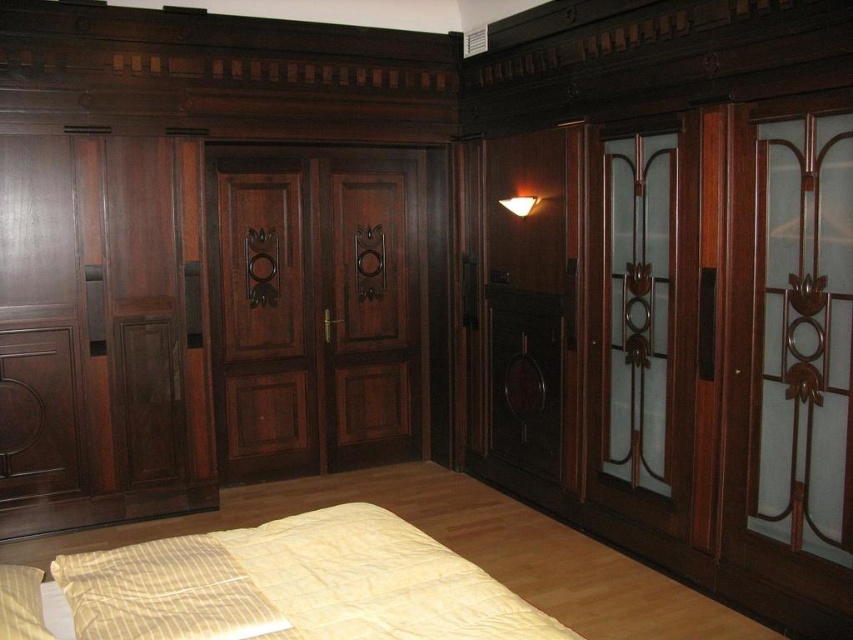
Is matte dark wood door at center to the left of matte white wall sconce at upper center from the viewer's perspective?

Correct, you'll find matte dark wood door at center to the left of matte white wall sconce at upper center.

Measure the distance between matte dark wood door at center and camera.

The distance of matte dark wood door at center from camera is 14.04 feet.

Describe the element at coordinates (314, 307) in the screenshot. I see `matte dark wood door at center` at that location.

Where is `matte dark wood door at center`? The height and width of the screenshot is (640, 853). matte dark wood door at center is located at coordinates (314, 307).

Locate an element on the screen. The image size is (853, 640). yellow striped fabric at lower center is located at coordinates (294, 586).

Identify the location of yellow striped fabric at lower center. (294, 586).

Is point (799, 113) positioned behind point (695, 160)?

No, (799, 113) is in front of (695, 160).

Can you confirm if transparent glass door at right is positioned to the right of mahogany wood door at right?

Indeed, transparent glass door at right is positioned on the right side of mahogany wood door at right.

Who is more forward, (795, 502) or (607, 148)?

Point (795, 502) is in front.

Identify the location of transparent glass door at right. (788, 368).